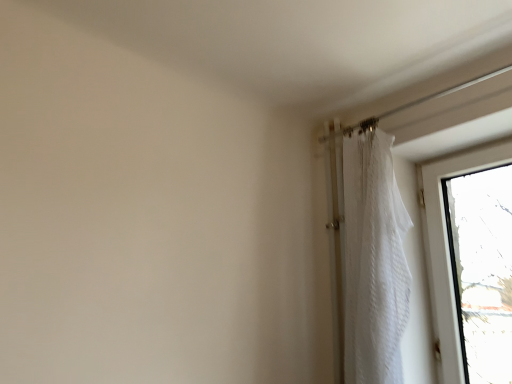
Where is `white sheer curtain at upper right`? white sheer curtain at upper right is located at coordinates (374, 262).

The height and width of the screenshot is (384, 512). Describe the element at coordinates (374, 262) in the screenshot. I see `white sheer curtain at upper right` at that location.

What do you see at coordinates (448, 250) in the screenshot? The height and width of the screenshot is (384, 512). I see `transparent glass window at upper right` at bounding box center [448, 250].

Where is `transparent glass window at upper right`? The image size is (512, 384). transparent glass window at upper right is located at coordinates (448, 250).

Locate an element on the screen. Image resolution: width=512 pixels, height=384 pixels. white sheer curtain at upper right is located at coordinates (374, 262).

Can you confirm if white sheer curtain at upper right is positioned to the right of transparent glass window at upper right?

No, white sheer curtain at upper right is not to the right of transparent glass window at upper right.

In the image, is white sheer curtain at upper right positioned in front of or behind transparent glass window at upper right?

In the image, white sheer curtain at upper right appears in front of transparent glass window at upper right.

Does point (394, 260) appear closer or farther from the camera than point (449, 315)?

Point (394, 260).

From the image's perspective, between white sheer curtain at upper right and transparent glass window at upper right, which one is located above?

white sheer curtain at upper right.

From a real-world perspective, who is located lower, white sheer curtain at upper right or transparent glass window at upper right?

In real-world perspective, transparent glass window at upper right is lower.

Considering the sizes of white sheer curtain at upper right and transparent glass window at upper right in the image, is white sheer curtain at upper right wider or thinner than transparent glass window at upper right?

In the image, white sheer curtain at upper right appears to be wider than transparent glass window at upper right.

Considering the sizes of objects white sheer curtain at upper right and transparent glass window at upper right in the image provided, who is shorter, white sheer curtain at upper right or transparent glass window at upper right?

Standing shorter between the two is transparent glass window at upper right.

Between white sheer curtain at upper right and transparent glass window at upper right, which one has larger size?

Bigger between the two is white sheer curtain at upper right.

Is white sheer curtain at upper right positioned beyond the bounds of transparent glass window at upper right?

Indeed, white sheer curtain at upper right is completely outside transparent glass window at upper right.

Would you say white sheer curtain at upper right is a long distance from transparent glass window at upper right?

white sheer curtain at upper right is actually quite close to transparent glass window at upper right.

Consider the image. Is white sheer curtain at upper right facing away from transparent glass window at upper right?

No, white sheer curtain at upper right is not facing the opposite direction of transparent glass window at upper right.

What's the angular difference between white sheer curtain at upper right and transparent glass window at upper right's facing directions?

The angular difference between white sheer curtain at upper right and transparent glass window at upper right is 1.95 degrees.

From the picture: Measure the distance from white sheer curtain at upper right to transparent glass window at upper right.

They are 14.06 inches apart.

Where is `curtain above the transparent glass window at upper right (from the image's perspective)`? The width and height of the screenshot is (512, 384). curtain above the transparent glass window at upper right (from the image's perspective) is located at coordinates (374, 262).

Which object is positioned more to the left, transparent glass window at upper right or white sheer curtain at upper right?

white sheer curtain at upper right is more to the left.

Relative to white sheer curtain at upper right, is transparent glass window at upper right in front or behind?

transparent glass window at upper right is behind white sheer curtain at upper right.

Is point (510, 158) positioned before point (376, 270)?

No, it is behind (376, 270).

From the image's perspective, is transparent glass window at upper right positioned above or below white sheer curtain at upper right?

transparent glass window at upper right is situated lower than white sheer curtain at upper right in the image.

Looking at this image, from a real-world perspective, which is physically below, transparent glass window at upper right or white sheer curtain at upper right?

In real-world perspective, transparent glass window at upper right is lower.

Considering the relative sizes of transparent glass window at upper right and white sheer curtain at upper right in the image provided, is transparent glass window at upper right wider than white sheer curtain at upper right?

No.

Which of these two, transparent glass window at upper right or white sheer curtain at upper right, stands shorter?

With less height is transparent glass window at upper right.

Considering the sizes of objects transparent glass window at upper right and white sheer curtain at upper right in the image provided, who is smaller, transparent glass window at upper right or white sheer curtain at upper right?

Smaller between the two is transparent glass window at upper right.

Do you think transparent glass window at upper right is within white sheer curtain at upper right, or outside of it?

transparent glass window at upper right exists outside the volume of white sheer curtain at upper right.

Is there a large distance between transparent glass window at upper right and white sheer curtain at upper right?

No.

Could you tell me if transparent glass window at upper right is facing white sheer curtain at upper right?

Yes, transparent glass window at upper right is facing white sheer curtain at upper right.

How many degrees apart are the facing directions of transparent glass window at upper right and white sheer curtain at upper right?

There is a 1.95-degree angle between the facing directions of transparent glass window at upper right and white sheer curtain at upper right.

How distant is transparent glass window at upper right from white sheer curtain at upper right?

They are 14.06 inches apart.

Locate an element on the screen. window behind the white sheer curtain at upper right is located at coordinates (448, 250).

Where is `window below the white sheer curtain at upper right (from a real-world perspective)`? window below the white sheer curtain at upper right (from a real-world perspective) is located at coordinates (448, 250).

Where is `window lying behind the white sheer curtain at upper right`? Image resolution: width=512 pixels, height=384 pixels. window lying behind the white sheer curtain at upper right is located at coordinates (448, 250).